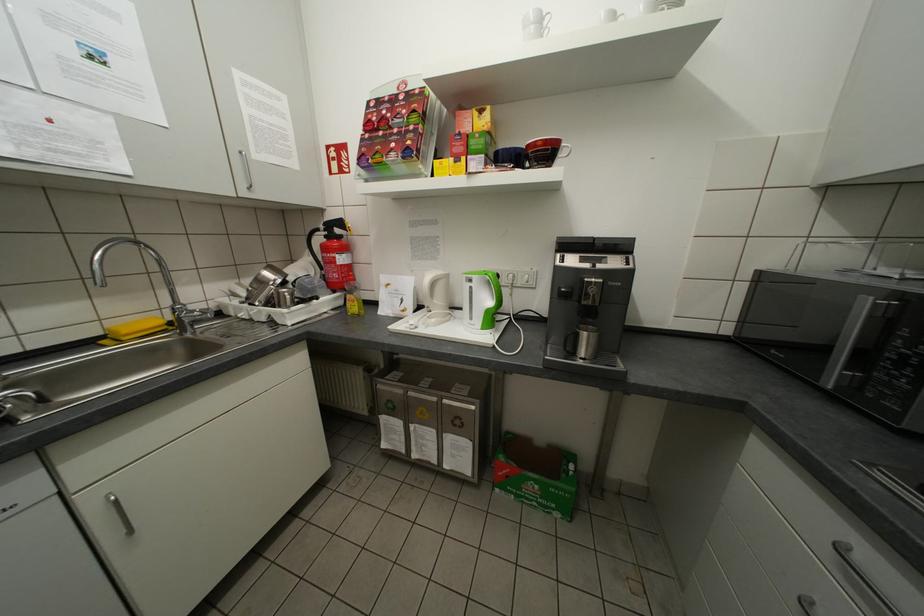
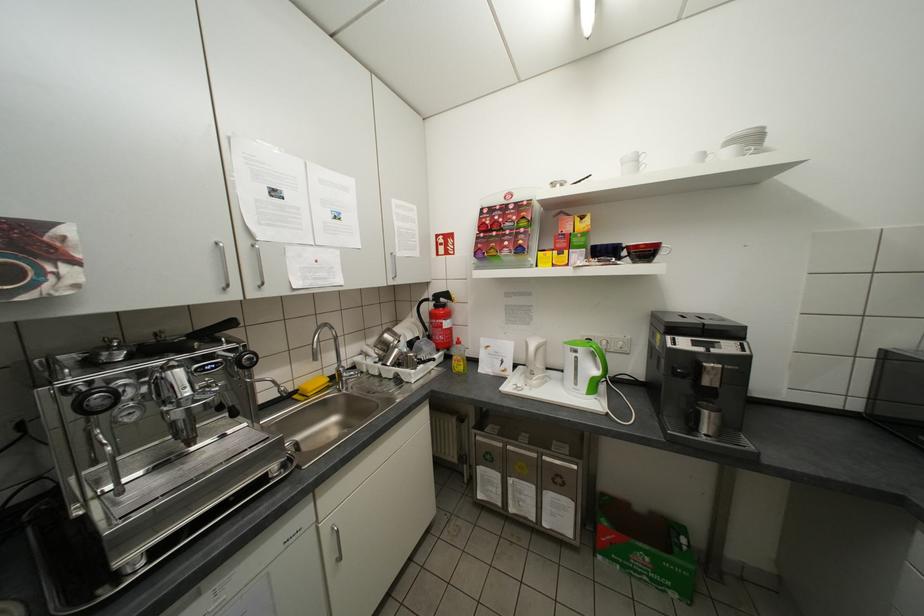
Where in the second image is the point corresponding to (x=602, y=280) from the first image?

(721, 365)